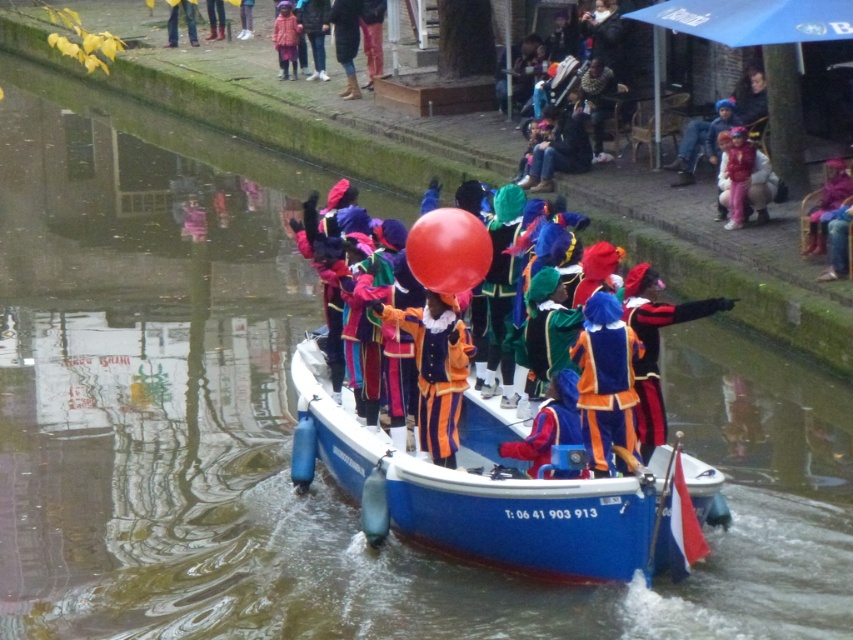
Question: Can you confirm if blue glossy boat at center is positioned below velvet red coat at center?

Choices:
 (A) yes
 (B) no

Answer: (A)

Question: Can you confirm if velvet orange costume at center is thinner than jeans at upper center?

Choices:
 (A) no
 (B) yes

Answer: (B)

Question: Based on their relative distances, which object is farther from the velvet red cape at center?

Choices:
 (A) rubber balloon at center
 (B) blue glossy boat at center
 (C) pink fabric coat at upper center

Answer: (C)

Question: Among these objects, which one is nearest to the camera?

Choices:
 (A) velvet red cape at center
 (B) jeans at upper center
 (C) velvet orange coat at center

Answer: (A)

Question: Which point is farther to the camera?

Choices:
 (A) jeans at upper center
 (B) blue glossy boat at center
 (C) pink fabric coat at upper center

Answer: (A)

Question: Does orange velvet costume at center appear on the left side of velvet red cape at center?

Choices:
 (A) yes
 (B) no

Answer: (B)